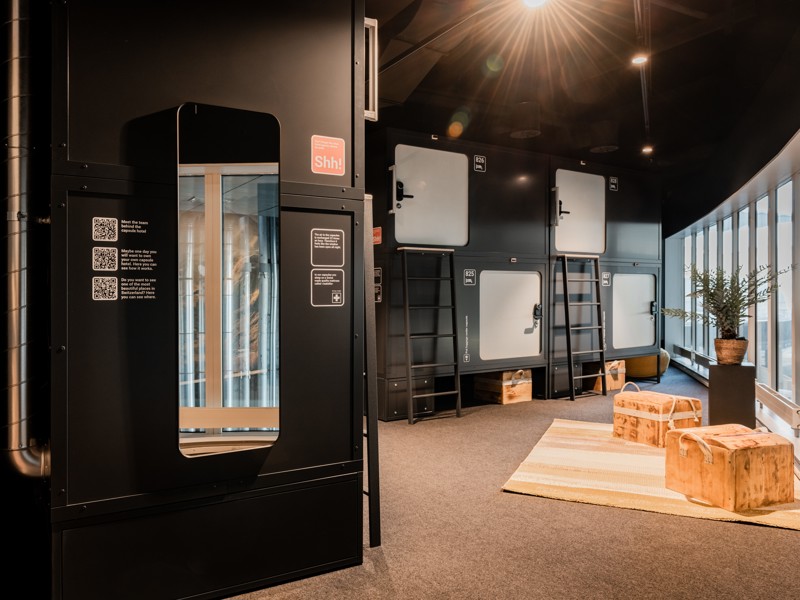
The width and height of the screenshot is (800, 600). In order to click on door in this screenshot , I will do `click(310, 95)`, `click(434, 195)`, `click(496, 318)`, `click(592, 226)`, `click(636, 315)`.